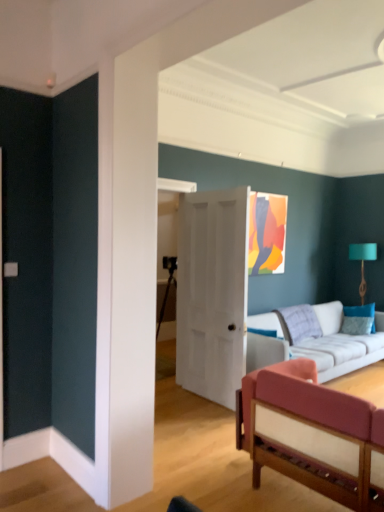
The height and width of the screenshot is (512, 384). What are the coordinates of `free spot to the left of velvet pink couch at lower right, arranged as the 2th studio couch when viewed from the back` in the screenshot? It's located at (200, 470).